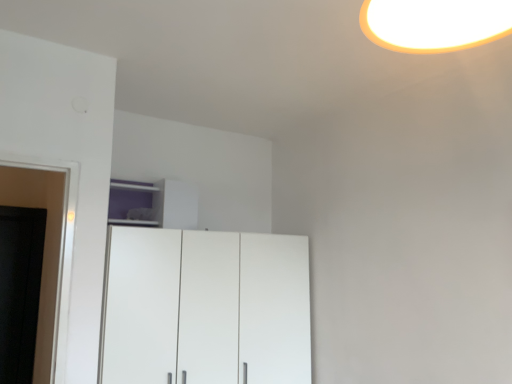
Question: Is purple matte cabinet at upper center closer to the viewer compared to white glossy cupboard at center?

Choices:
 (A) yes
 (B) no

Answer: (B)

Question: Does purple matte cabinet at upper center have a larger size compared to white glossy cupboard at center?

Choices:
 (A) yes
 (B) no

Answer: (B)

Question: Does purple matte cabinet at upper center have a lesser height compared to white glossy cupboard at center?

Choices:
 (A) no
 (B) yes

Answer: (B)

Question: From a real-world perspective, is purple matte cabinet at upper center beneath white glossy cupboard at center?

Choices:
 (A) yes
 (B) no

Answer: (B)

Question: Is purple matte cabinet at upper center wider than white glossy cupboard at center?

Choices:
 (A) no
 (B) yes

Answer: (A)

Question: From a real-world perspective, is purple matte cabinet at upper center physically above white glossy cupboard at center?

Choices:
 (A) yes
 (B) no

Answer: (A)

Question: Is white glossy cupboard at center to the left of purple matte cabinet at upper center from the viewer's perspective?

Choices:
 (A) yes
 (B) no

Answer: (B)

Question: Would you say white glossy cupboard at center contains purple matte cabinet at upper center?

Choices:
 (A) no
 (B) yes

Answer: (A)

Question: Are white glossy cupboard at center and purple matte cabinet at upper center far apart?

Choices:
 (A) yes
 (B) no

Answer: (B)

Question: Is white glossy cupboard at center at the right side of purple matte cabinet at upper center?

Choices:
 (A) yes
 (B) no

Answer: (A)

Question: From the image's perspective, is white glossy cupboard at center beneath purple matte cabinet at upper center?

Choices:
 (A) yes
 (B) no

Answer: (A)

Question: Is the depth of white glossy cupboard at center less than that of purple matte cabinet at upper center?

Choices:
 (A) yes
 (B) no

Answer: (A)

Question: Is point (112, 221) closer or farther from the camera than point (205, 314)?

Choices:
 (A) closer
 (B) farther

Answer: (B)